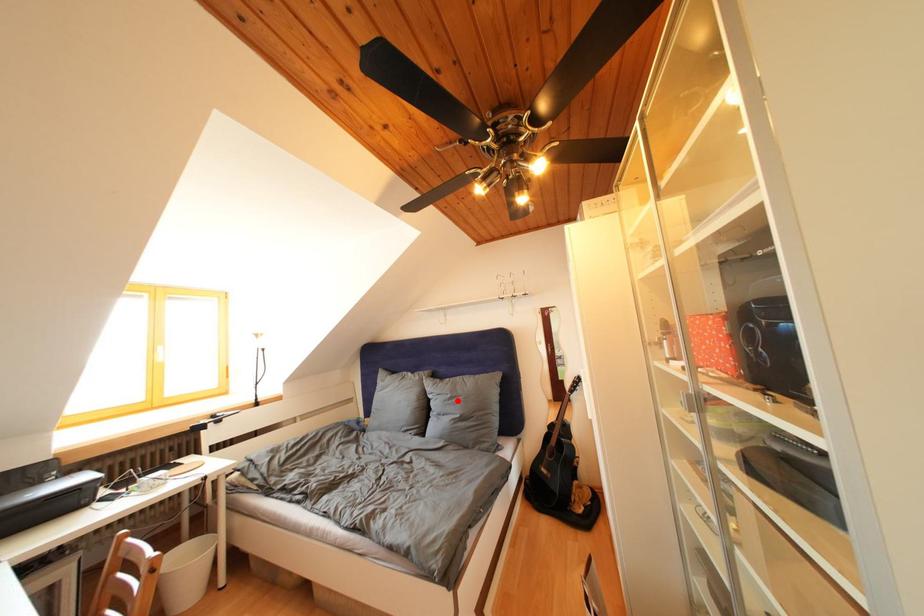
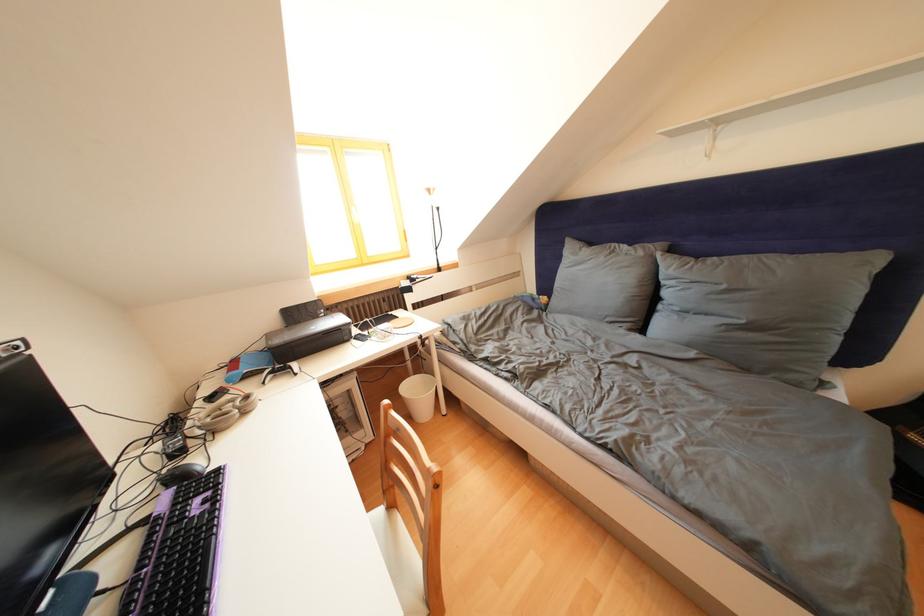
Find the pixel in the second image that matches the highlighted location in the first image.

(733, 292)